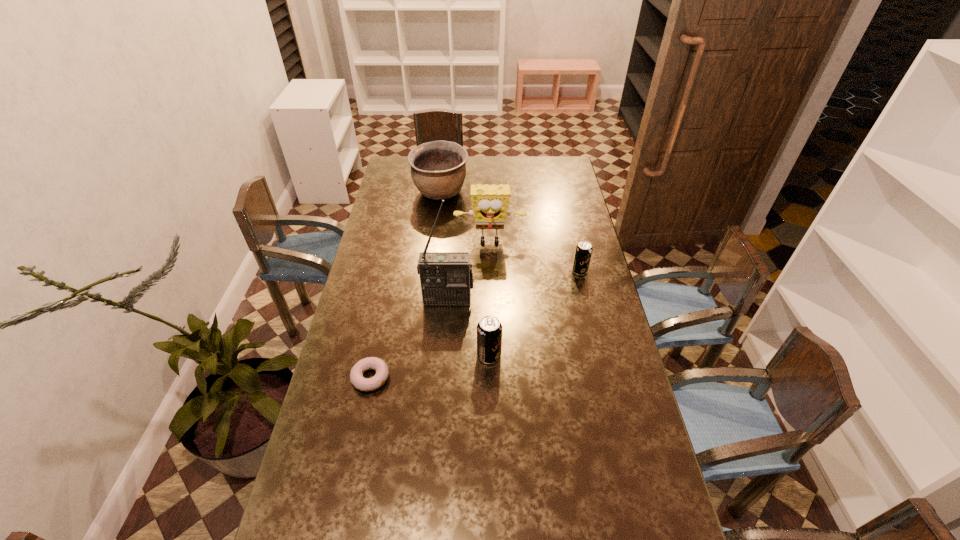
I want to click on free space between the second shortest object and the pottery, so click(510, 232).

Locate an element on the screen. free space that is in between the second shortest object and the tallest object is located at coordinates (514, 285).

Locate an element on the screen. The height and width of the screenshot is (540, 960). free spot between the right soda can and the farthest object is located at coordinates (510, 232).

Identify the location of unoccupied position between the farther soda can and the fourth tallest object. Image resolution: width=960 pixels, height=540 pixels. (535, 313).

The image size is (960, 540). I want to click on vacant space that is in between the shortest object and the sponge, so click(430, 310).

Identify the location of empty location between the third nearest object and the pottery. (444, 246).

Find the location of a particular element. The height and width of the screenshot is (540, 960). the third closest object to the pottery is located at coordinates click(583, 252).

Find the location of a particular element. This screenshot has height=540, width=960. the second closest object relative to the farthest object is located at coordinates (446, 278).

The image size is (960, 540). I want to click on free space that satisfies the following two spatial constraints: 1. on the back side of the second shortest object; 2. on the right side of the doughnut, so point(393,271).

Find the location of a particular element. vacant area that satisfies the following two spatial constraints: 1. on the display of the taller soda can; 2. on the right side of the tallest object is located at coordinates (444, 355).